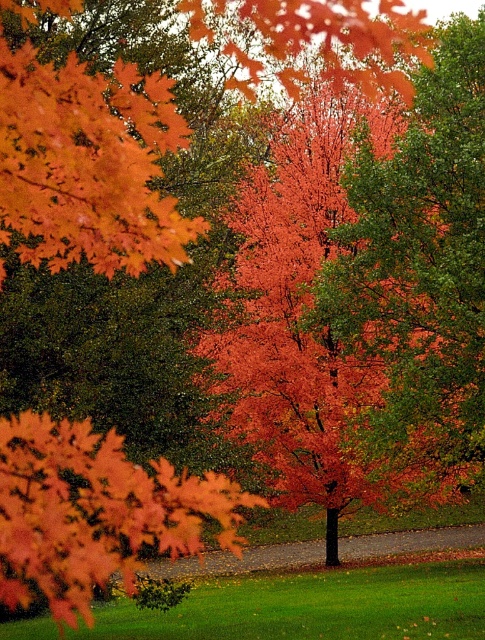
You are standing at the point closer to the camera in the image. Which point are you standing at, point (108, 157) or point (7, 522)?

You are standing at point (7, 522) because it is closer to the camera than point (108, 157).

You are an artist trying to paint the autumn scene. You want to ensure the shiny orange maple leaf at upper left and the shiny orange maple at center are proportionally accurate. Which of the two maple leaves is thinner?

The shiny orange maple leaf at upper left is thinner than the shiny orange maple at center.